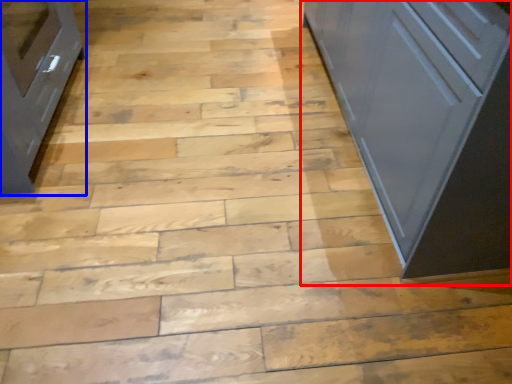
Question: Which object is further to the camera taking this photo, cupboard (highlighted by a red box) or cabinetry (highlighted by a blue box)?

Choices:
 (A) cupboard
 (B) cabinetry

Answer: (B)